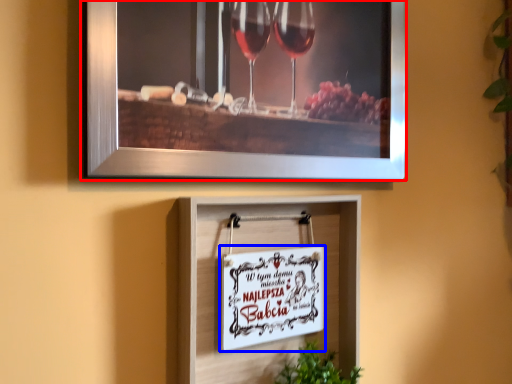
Question: Which point is closer to the camera, picture frame (highlighted by a red box) or picture frame (highlighted by a blue box)?

Choices:
 (A) picture frame
 (B) picture frame

Answer: (A)